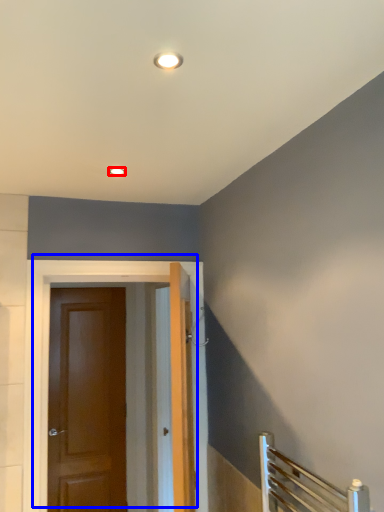
Question: Which object is closer to the camera taking this photo, lighting (highlighted by a red box) or door (highlighted by a blue box)?

Choices:
 (A) lighting
 (B) door

Answer: (A)